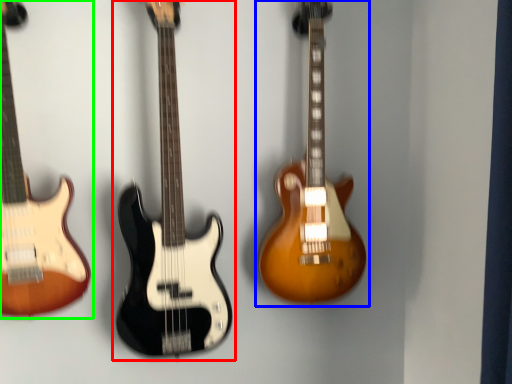
Question: Which object is the closest to the guitar (highlighted by a red box)? Choose among these: guitar (highlighted by a blue box) or guitar (highlighted by a green box).

Choices:
 (A) guitar
 (B) guitar

Answer: (B)